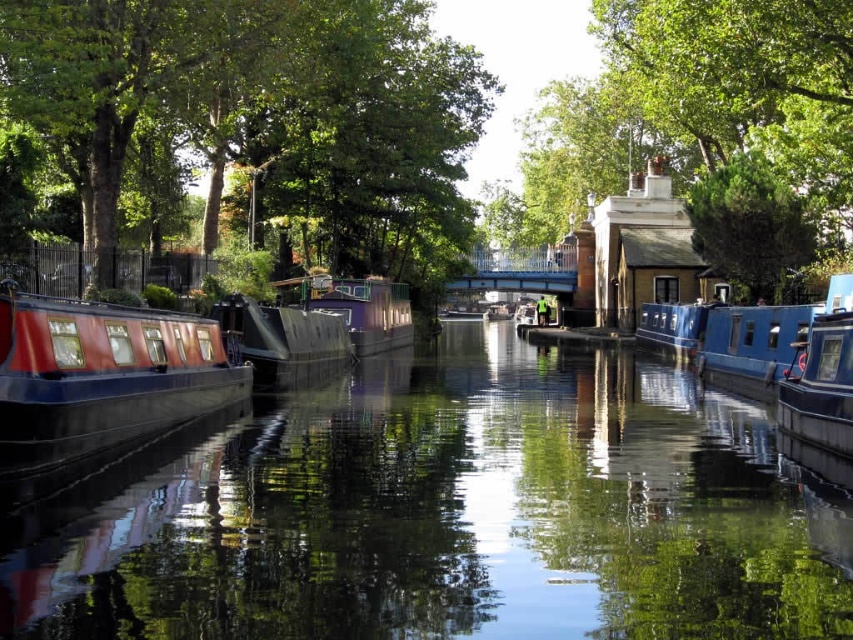
You are standing at the point labeled as point (257, 118) in the canal scene. What object is directly above this point?

The point (257, 118) is located on the green leafy tree at upper left, so the object directly above this point would be part of the same tree or possibly the sky, but according to the description, the point itself is on the green leafy tree at upper left.

You are a photographer standing at the edge of the canal. You want to take a photo that includes both point [115,403] and point [705,307]. Which point will appear larger in your photo?

Point [115,403] is closer to the camera than point [705,307], so it will appear larger in the photo.

You are a photographer aiming to capture the purple matte boat at center without the green leafy tree at upper right blocking the view. What adjustment should you make to your camera angle?

The green leafy tree at upper right is above the purple matte boat at center, so you should lower your camera angle to avoid the tree blocking the view of the boat.